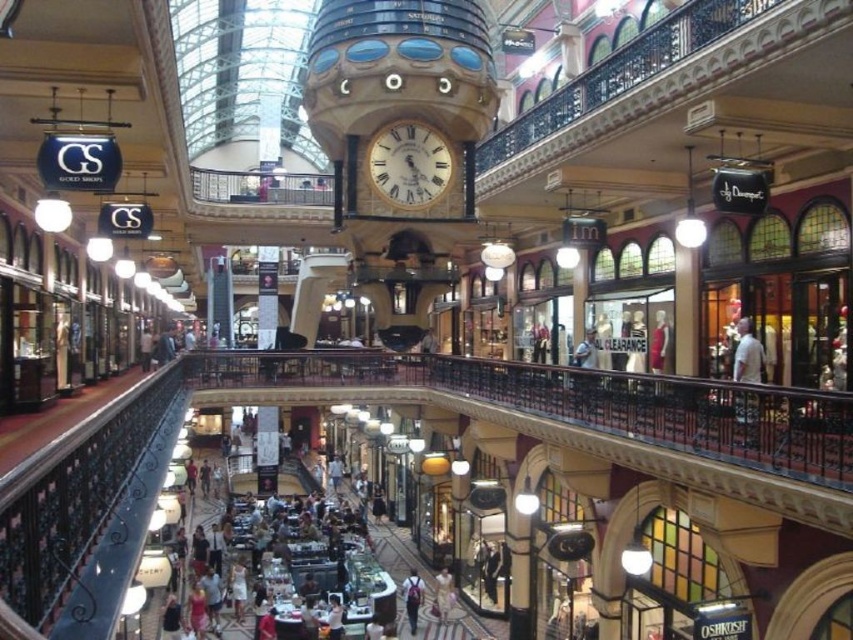
You are a visitor in the shopping arcade and want to take a photo of both the gold metallic clock at center and the matte gray backpack at center. Which object should you zoom in more on to ensure both are clearly visible in the frame?

You should zoom in more on the gold metallic clock at center because it is smaller than the matte gray backpack at center, allowing both to fit clearly in the frame.

You are standing at the entrance of the shopping arcade and see the point marked as point (409, 164). What object is located at that point?

The gold metallic clock at center is located at point (409, 164).

You are standing at the entrance of the shopping arcade and want to take a photo that includes both the point at coordinates point (402, 147) and point (405, 595). Based on their positions, which point will appear larger in the photo?

Point (402, 147) is closer to the camera than point (405, 595), so it will appear larger in the photo.